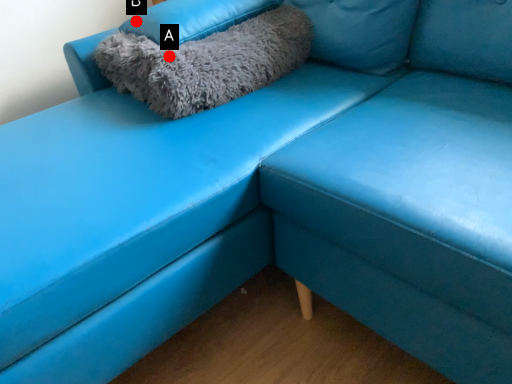
Question: Two points are circled on the image, labeled by A and B beside each circle. Among these points, which one is farthest from the camera?

Choices:
 (A) A is further
 (B) B is further

Answer: (B)